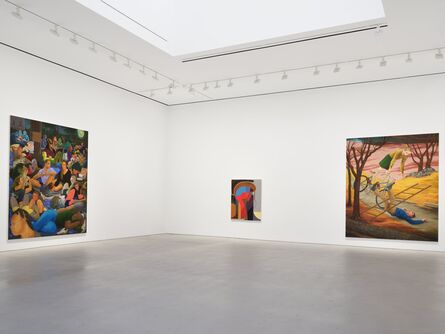
Identify the location of edge of tray ceiling. This screenshot has height=334, width=445. [x=292, y=37], [x=384, y=4], [x=111, y=22].